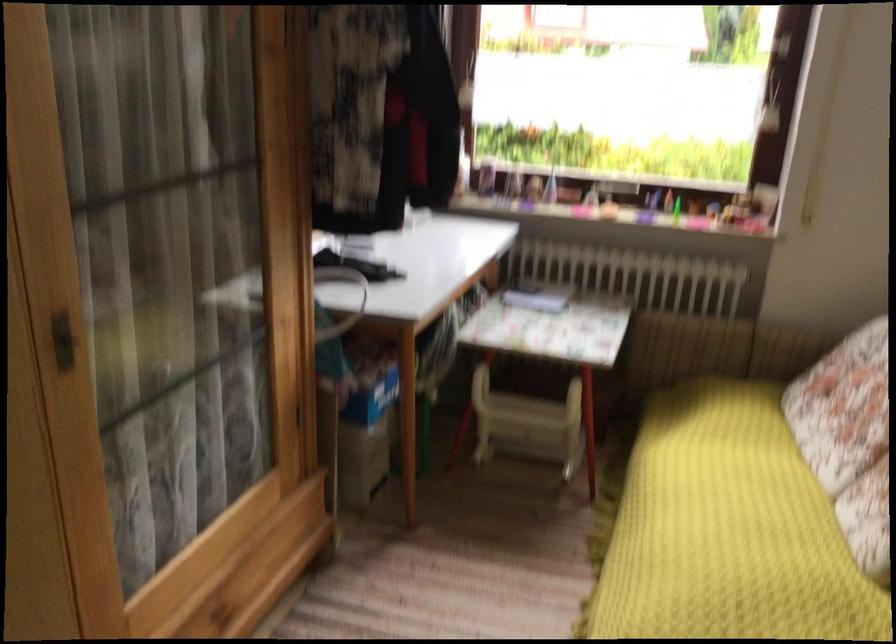
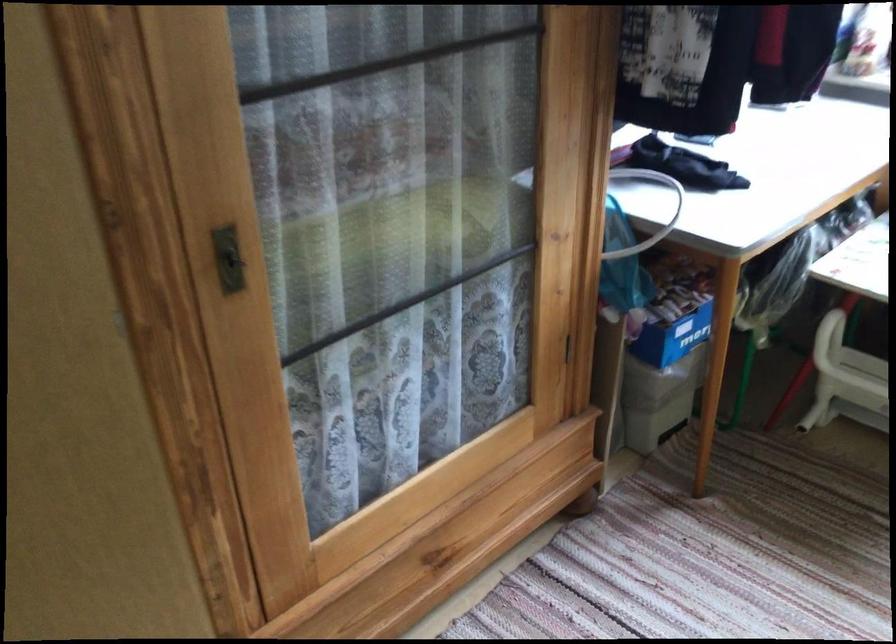
Question: What movement of the cameraman would produce the second image?

Choices:
 (A) Left
 (B) Right
 (C) Forward
 (D) Backward

Answer: (C)